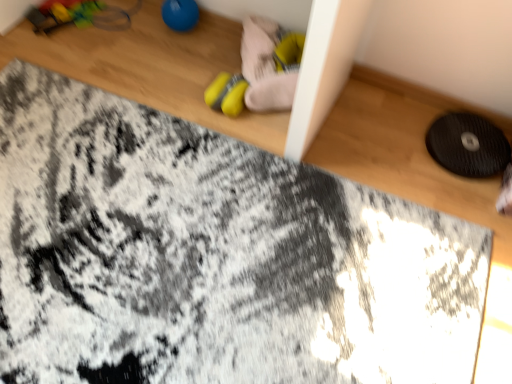
Question: Is yellow fabric shoe at upper center outside black textured mat at right?

Choices:
 (A) yes
 (B) no

Answer: (A)

Question: Does yellow fabric shoe at upper center lie in front of black textured mat at right?

Choices:
 (A) no
 (B) yes

Answer: (A)

Question: Is yellow fabric shoe at upper center at the left side of black textured mat at right?

Choices:
 (A) no
 (B) yes

Answer: (B)

Question: Does yellow fabric shoe at upper center appear on the right side of black textured mat at right?

Choices:
 (A) yes
 (B) no

Answer: (B)

Question: From a real-world perspective, is yellow fabric shoe at upper center over black textured mat at right?

Choices:
 (A) no
 (B) yes

Answer: (B)

Question: From the image's perspective, is yellow fabric shoe at upper center located beneath black textured mat at right?

Choices:
 (A) no
 (B) yes

Answer: (A)

Question: Is blue rubber ball at upper center, arranged as the 2th toy when viewed from the right, outside of yellow rubber toy at center, arranged as the first toy when viewed from the right?

Choices:
 (A) yes
 (B) no

Answer: (A)

Question: Can you confirm if blue rubber ball at upper center, arranged as the 2th toy when viewed from the right, is smaller than yellow rubber toy at center, the 2th toy in the left-to-right sequence?

Choices:
 (A) no
 (B) yes

Answer: (B)

Question: From the image's perspective, is blue rubber ball at upper center, the first toy in the left-to-right sequence, below yellow rubber toy at center, the 2th toy in the left-to-right sequence?

Choices:
 (A) no
 (B) yes

Answer: (A)

Question: Would you consider blue rubber ball at upper center, arranged as the 2th toy when viewed from the right, to be distant from yellow rubber toy at center, arranged as the first toy when viewed from the right?

Choices:
 (A) no
 (B) yes

Answer: (A)

Question: From the image's perspective, is blue rubber ball at upper center, arranged as the 2th toy when viewed from the right, above yellow rubber toy at center, the 2th toy in the left-to-right sequence?

Choices:
 (A) yes
 (B) no

Answer: (A)

Question: Does blue rubber ball at upper center, the first toy in the left-to-right sequence, come in front of yellow rubber toy at center, the 2th toy in the left-to-right sequence?

Choices:
 (A) no
 (B) yes

Answer: (A)

Question: Can you confirm if yellow fabric shoe at upper center is taller than blue rubber ball at upper center, arranged as the 2th toy when viewed from the right?

Choices:
 (A) no
 (B) yes

Answer: (A)